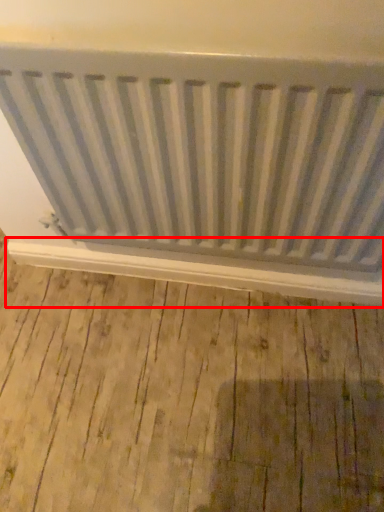
Question: From the image's perspective, what is the correct spatial relationship of window sill (annotated by the red box) in relation to radiator?

Choices:
 (A) above
 (B) below

Answer: (B)